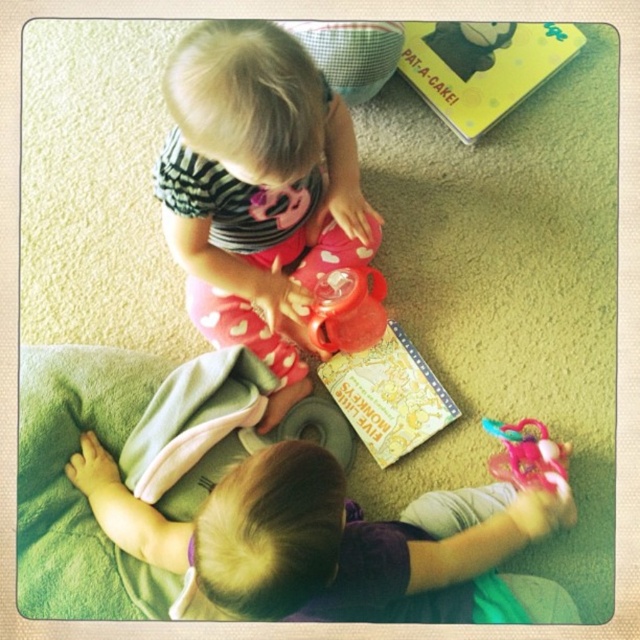
You are a parent trying to locate your child who is wearing pink fabric pants at center and a yellow matte book at upper right. Based on the scene description, which object is closer to the left side of the room?

The pink fabric pants at center is positioned on the left side of the yellow matte book at upper right, so the pink fabric pants at center is closer to the left side of the room.

You are a parent trying to locate your child wearing pink fabric pants at center in the image. Based on the coordinates provided, where would you expect to find them?

The pink fabric pants at center are located at coordinates point (259, 189).

Consider the image. What is the location of the point with coordinates (259, 189) in the image?

The point with coordinates (259, 189) is located on the pink fabric pants at center.